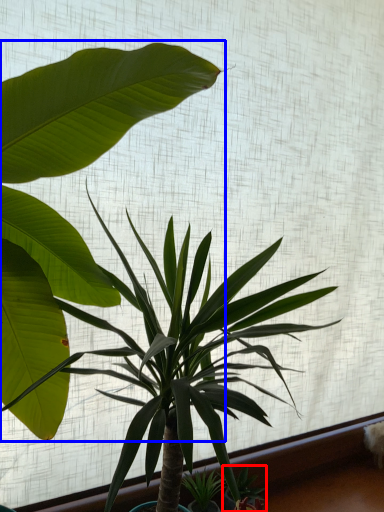
Question: Which point is closer to the camera, plant (highlighted by a red box) or houseplant (highlighted by a blue box)?

Choices:
 (A) plant
 (B) houseplant

Answer: (B)